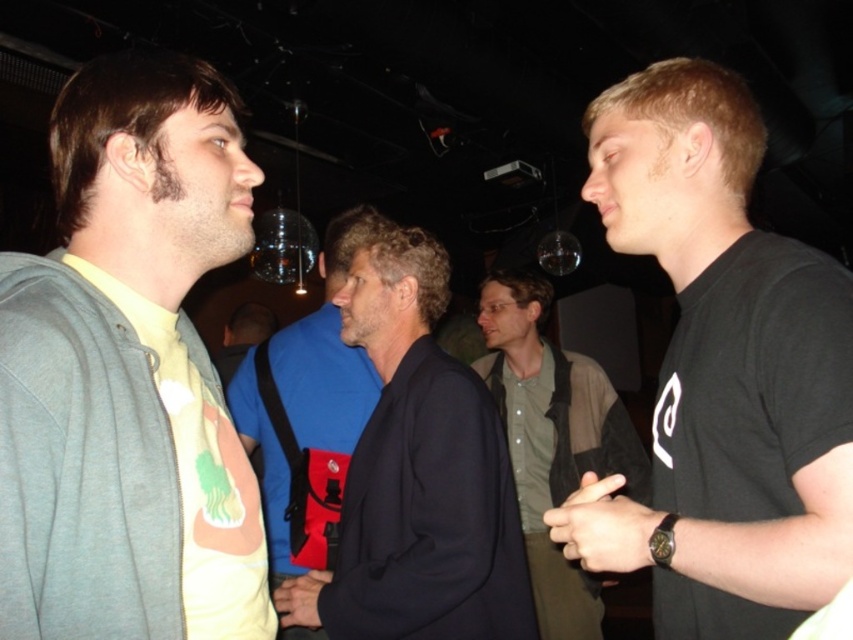
Can you confirm if light yellow t-shirt at left is smaller than dark blue jacket at center?

Indeed, light yellow t-shirt at left has a smaller size compared to dark blue jacket at center.

Does light yellow t-shirt at left have a greater width compared to dark blue jacket at center?

No, light yellow t-shirt at left is not wider than dark blue jacket at center.

Image resolution: width=853 pixels, height=640 pixels. What do you see at coordinates (128, 372) in the screenshot? I see `light yellow t-shirt at left` at bounding box center [128, 372].

What are the coordinates of `light yellow t-shirt at left` in the screenshot? It's located at (128, 372).

Is dark blue jacket at center smaller than green shirt at center?

Indeed, dark blue jacket at center has a smaller size compared to green shirt at center.

Does dark blue jacket at center appear on the left side of green shirt at center?

Indeed, dark blue jacket at center is positioned on the left side of green shirt at center.

Does point (457, 442) come closer to viewer compared to point (537, 461)?

Yes, it is in front of point (537, 461).

The width and height of the screenshot is (853, 640). I want to click on dark blue jacket at center, so click(x=418, y=476).

Does point (227, 548) lie in front of point (280, 540)?

Yes, point (227, 548) is closer to viewer.

Does light yellow t-shirt at left appear over blue fabric shirt at center?

Correct, light yellow t-shirt at left is located above blue fabric shirt at center.

Is point (73, 188) in front of point (317, 397)?

Yes, it is in front of point (317, 397).

Image resolution: width=853 pixels, height=640 pixels. Identify the location of light yellow t-shirt at left. (128, 372).